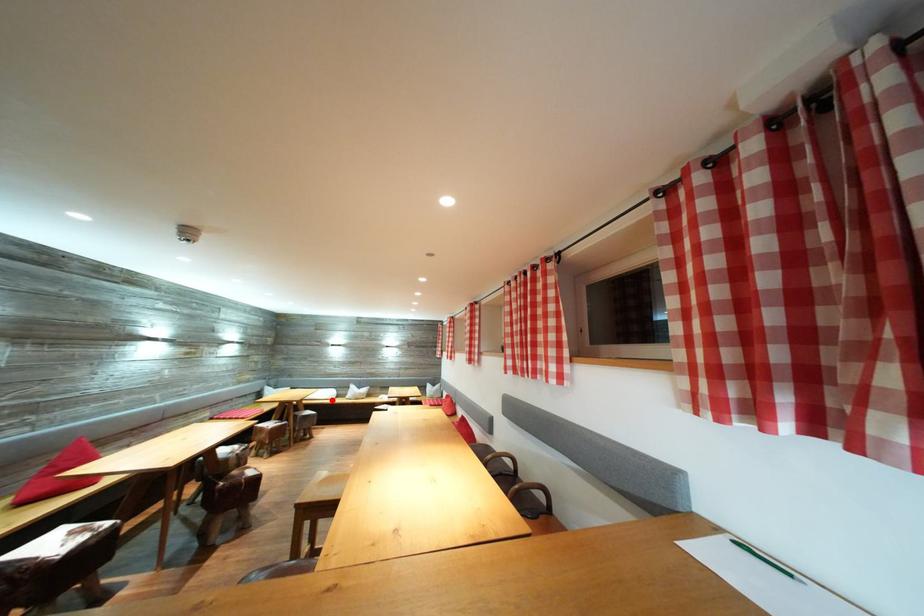
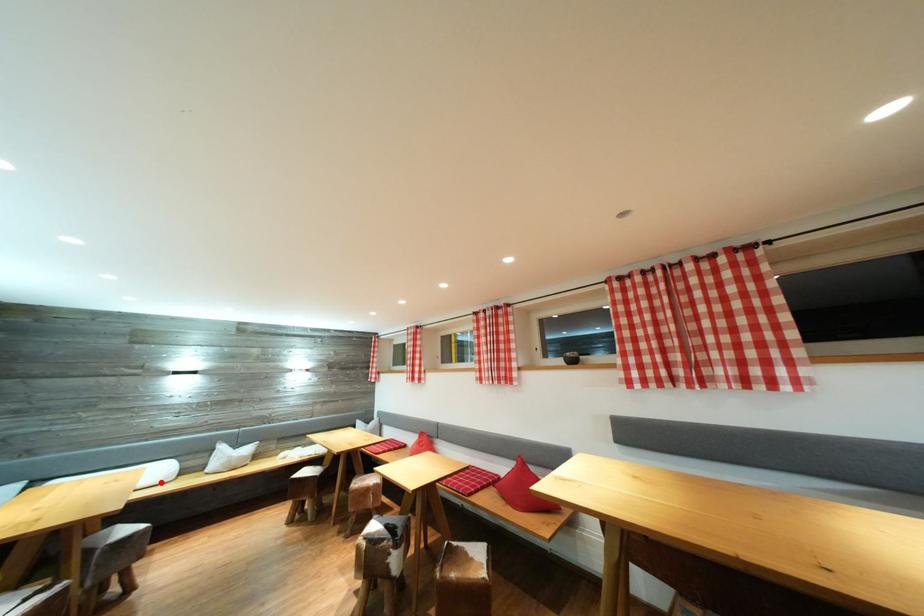
I am providing you with two images of the same scene from different viewpoints. A red point is marked on the first image and another point is marked on the second image. Do the highlighted points in image1 and image2 indicate the same real-world spot?

Yes